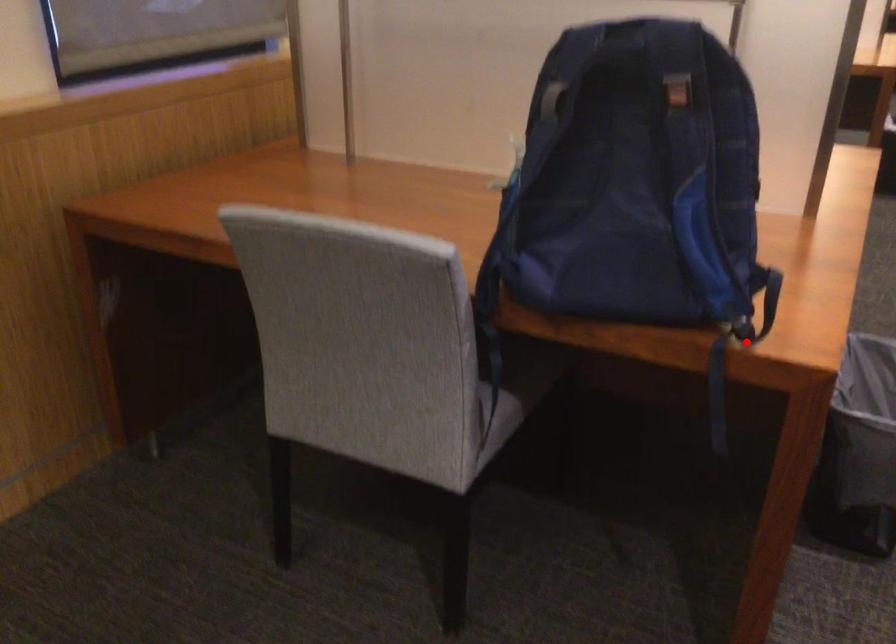
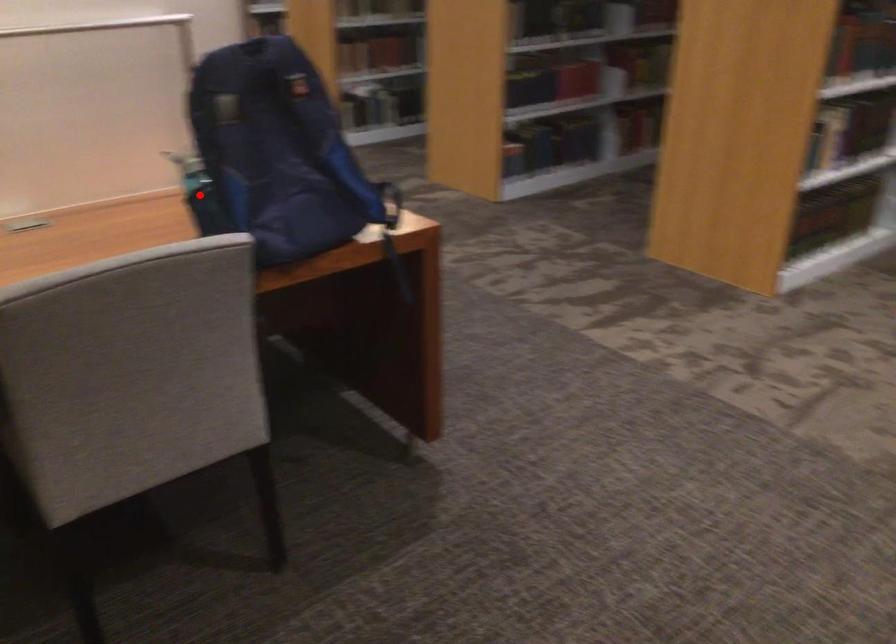
I am providing you with two images of the same scene from different viewpoints. A red point is marked on the first image and another point is marked on the second image. Is the marked point in image1 the same physical position as the marked point in image2?

No